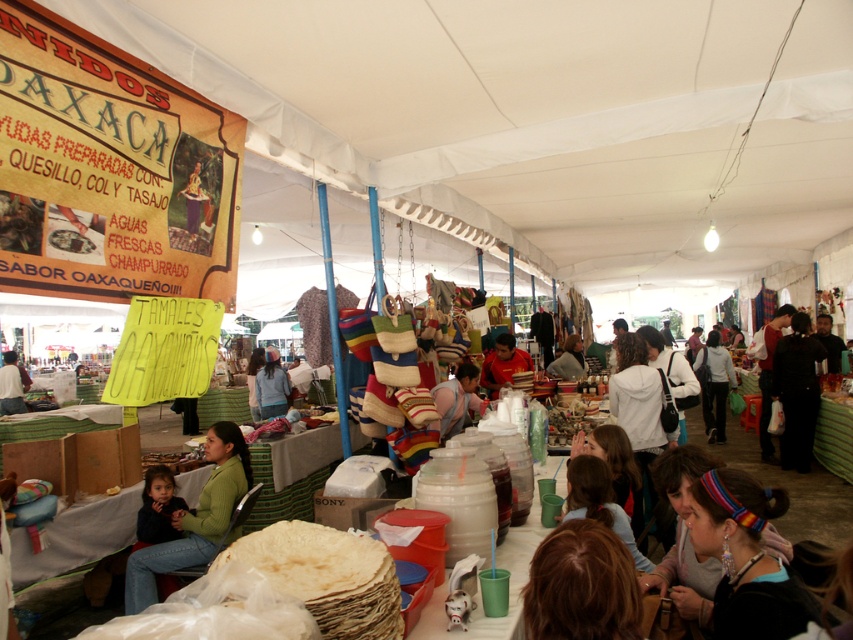
Question: Can you confirm if green knitted sweater at lower left is positioned to the right of matte red shirt at center?

Choices:
 (A) yes
 (B) no

Answer: (B)

Question: Which point is farther to the camera?

Choices:
 (A) (792, 406)
 (B) (506, 365)

Answer: (A)

Question: Is white cotton hoodie at center wider than matte red shirt at center?

Choices:
 (A) no
 (B) yes

Answer: (B)

Question: Which point is closer to the camera?

Choices:
 (A) white cotton hoodie at center
 (B) green fabric shirt at center
 (C) green knitted sweater at lower left

Answer: (C)

Question: Which point is closer to the camera taking this photo?

Choices:
 (A) (276, 380)
 (B) (791, 326)

Answer: (B)

Question: Is matte brown woven hat at center to the right of matte red shirt at center from the viewer's perspective?

Choices:
 (A) yes
 (B) no

Answer: (B)